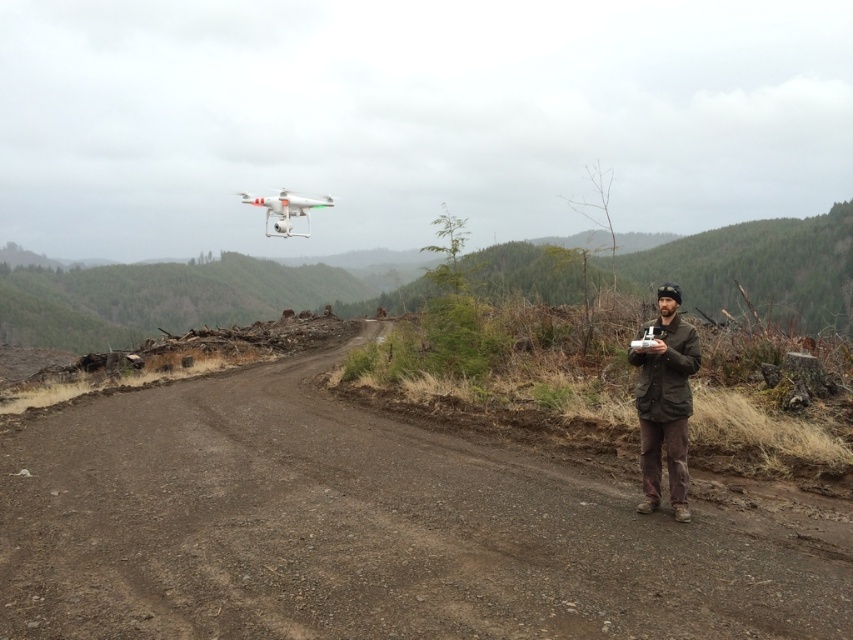
Between point (677, 301) and point (281, 228), which one is positioned in front?

Point (677, 301) is more forward.

Who is higher up, brown woolen jacket at right or white matte drone at upper center?

Positioned higher is white matte drone at upper center.

The image size is (853, 640). I want to click on brown woolen jacket at right, so click(665, 403).

This screenshot has width=853, height=640. What are the coordinates of `brown dirt track at center` in the screenshot? It's located at (363, 531).

Does brown dirt track at center appear under brown woolen jacket at right?

Correct, brown dirt track at center is located below brown woolen jacket at right.

What are the coordinates of `brown dirt track at center` in the screenshot? It's located at (363, 531).

Find the location of a particular element. This screenshot has height=640, width=853. brown dirt track at center is located at coordinates (363, 531).

Between brown dirt track at center and white matte drone at upper center, which one appears on the left side from the viewer's perspective?

white matte drone at upper center is more to the left.

Where is `brown dirt track at center`? brown dirt track at center is located at coordinates (363, 531).